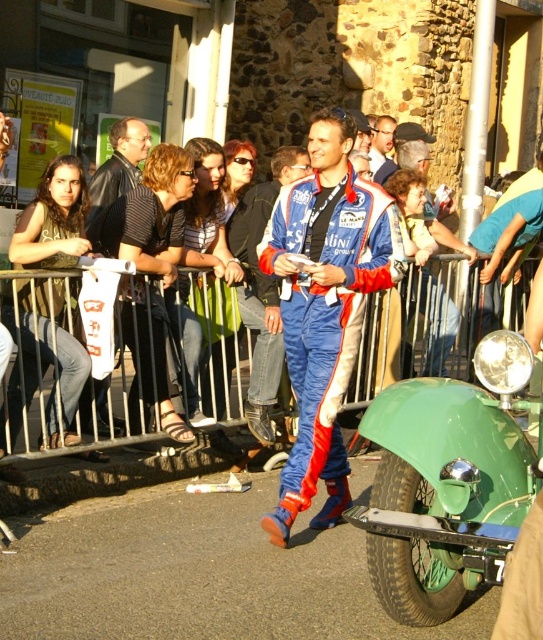
Question: Where is blue/white racing suit at center located in relation to blue racing suit at center in the image?

Choices:
 (A) left
 (B) right

Answer: (B)

Question: Is blue racing suit at center behind blue fabric racing suit at center?

Choices:
 (A) yes
 (B) no

Answer: (B)

Question: Which object appears closest to the camera in this image?

Choices:
 (A) blue racing suit at center
 (B) blue fabric racing suit at center
 (C) blue/white racing suit at center

Answer: (C)

Question: Which point is farther from the camera taking this photo?

Choices:
 (A) (370, 145)
 (B) (312, 492)
 (C) (266, 182)

Answer: (A)

Question: Which object appears closest to the camera in this image?

Choices:
 (A) blue/white racing suit at center
 (B) blue fabric racing suit at center

Answer: (A)

Question: Where is blue/white racing suit at center located in relation to blue racing suit at center in the image?

Choices:
 (A) above
 (B) below

Answer: (B)